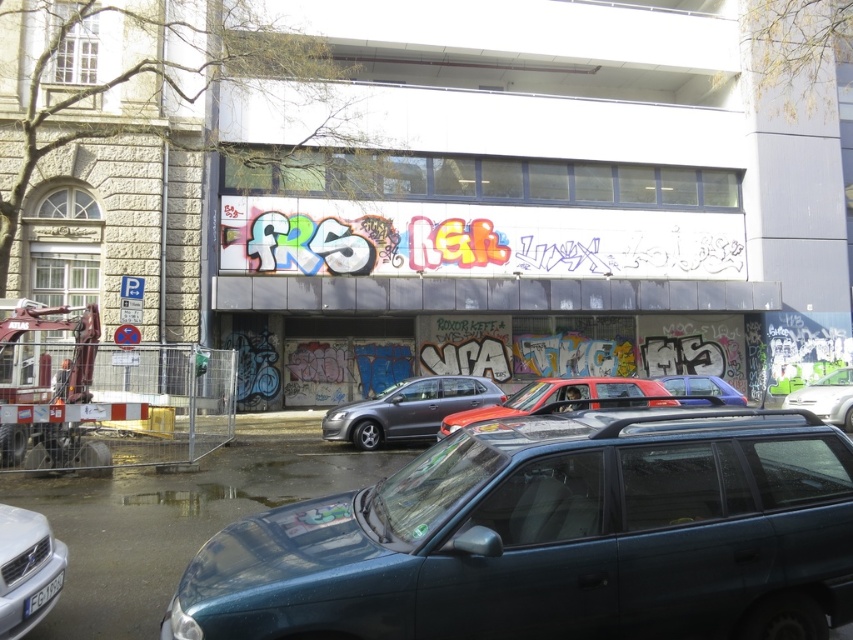
Does metallic blue minivan at lower center have a lesser height compared to metallic blue sedan at center?

Yes, metallic blue minivan at lower center is shorter than metallic blue sedan at center.

Who is lower down, metallic blue minivan at lower center or metallic blue sedan at center?

metallic blue sedan at center

This screenshot has width=853, height=640. Describe the element at coordinates (553, 538) in the screenshot. I see `metallic blue minivan at lower center` at that location.

At what (x,y) coordinates should I click in order to perform the action: click on metallic blue minivan at lower center. Please return your answer as a coordinate pair (x, y). The image size is (853, 640). Looking at the image, I should click on (553, 538).

How much distance is there between silver metallic car at lower left and white matte car at center?

The distance of silver metallic car at lower left from white matte car at center is 16.06 meters.

Is point (10, 520) more distant than point (819, 397)?

No, it is in front of (819, 397).

Identify the location of silver metallic car at lower left. Image resolution: width=853 pixels, height=640 pixels. (27, 570).

Between metallic red car at center and white matte car at center, which one is positioned higher?

Positioned higher is metallic red car at center.

Is metallic red car at center smaller than white matte car at center?

No, metallic red car at center is not smaller than white matte car at center.

Between point (575, 385) and point (819, 380), which one is positioned in front?

Positioned in front is point (575, 385).

Where is `metallic red car at center`? metallic red car at center is located at coordinates (563, 397).